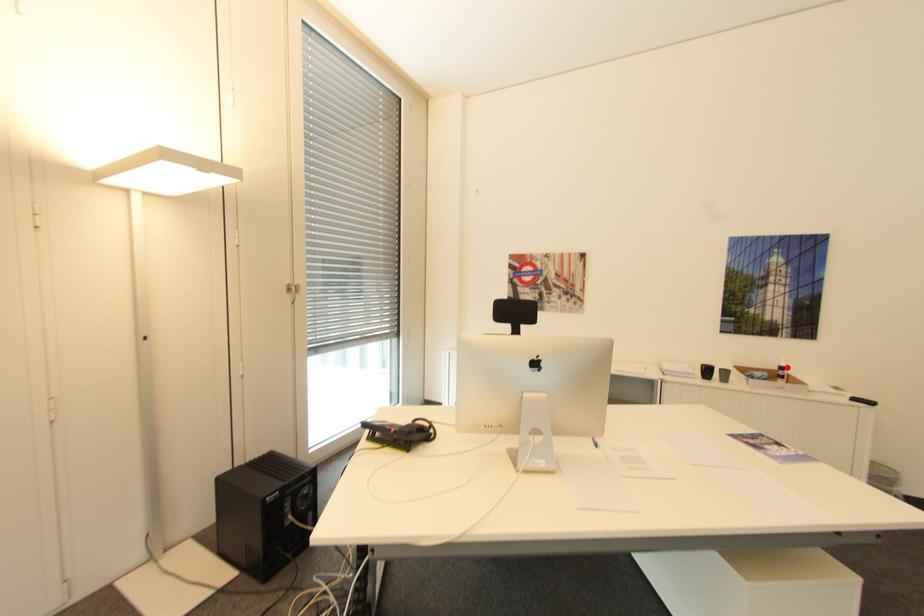
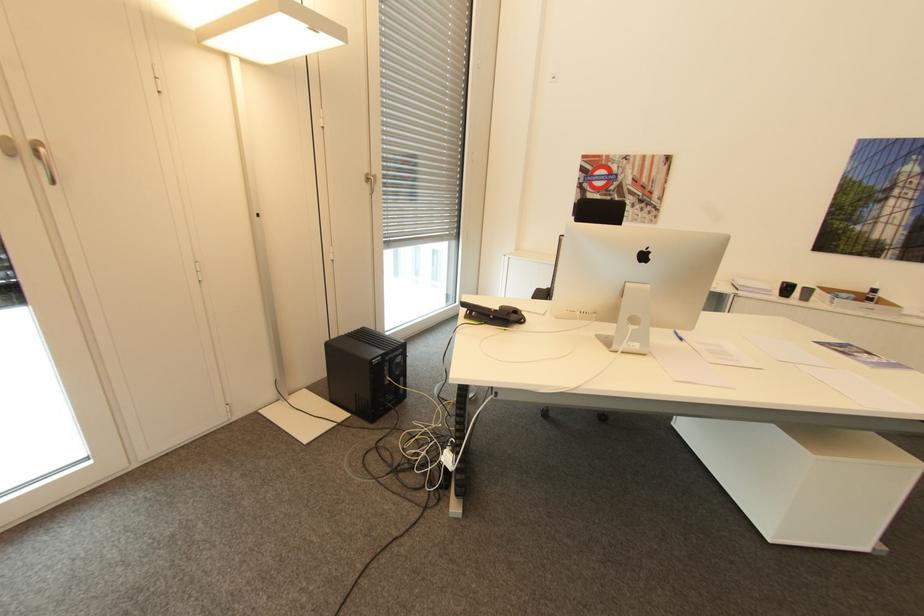
In the second image, find the point that corresponds to the highlighted location in the first image.

(879, 290)